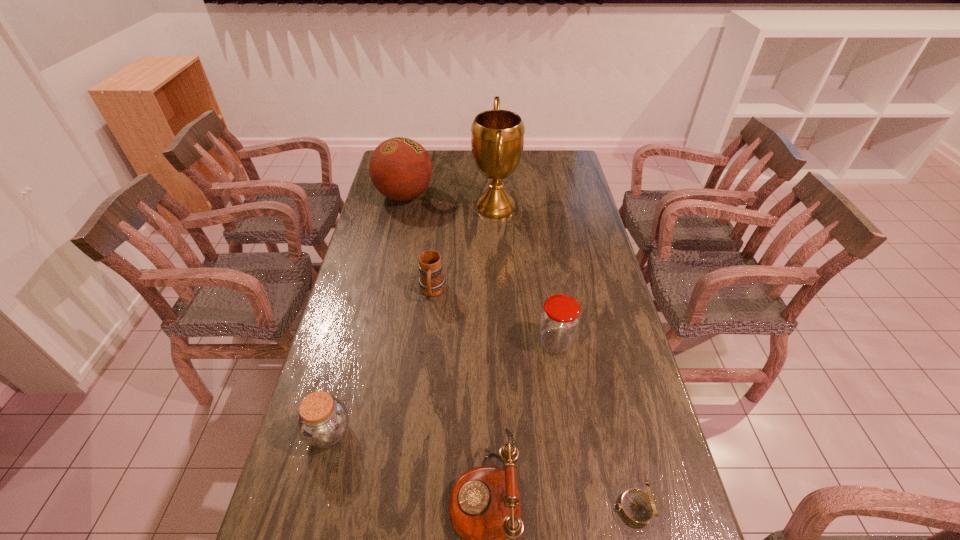
Identify the location of vacant area situated on the surface of the tallest object with symbols. (448, 207).

Image resolution: width=960 pixels, height=540 pixels. In order to click on vacant region located 0.100m on the surface of the tallest object with symbols in this screenshot , I will do `click(448, 207)`.

Locate an element on the screen. The image size is (960, 540). free space located on the front of the basketball is located at coordinates (391, 259).

This screenshot has height=540, width=960. What are the coordinates of `free space located 0.080m on the right of the fourth nearest object` in the screenshot? It's located at (600, 342).

The image size is (960, 540). In order to click on vacant region located on the side of the mug with the handle in this screenshot , I will do `click(427, 339)`.

At what (x,y) coordinates should I click in order to perform the action: click on blank area located on the right of the left jar. Please return your answer as a coordinate pair (x, y). The width and height of the screenshot is (960, 540). Looking at the image, I should click on (407, 432).

I want to click on blank area located 0.120m with the dial facing the compass, so click(x=561, y=508).

Find the location of a particular element. vacant space situated 0.130m with the dial facing the compass is located at coordinates (557, 508).

This screenshot has height=540, width=960. In order to click on free region located with the dial facing the compass in this screenshot , I will do `click(500, 508)`.

The height and width of the screenshot is (540, 960). What are the coordinates of `basketball present at the left edge` in the screenshot? It's located at (400, 168).